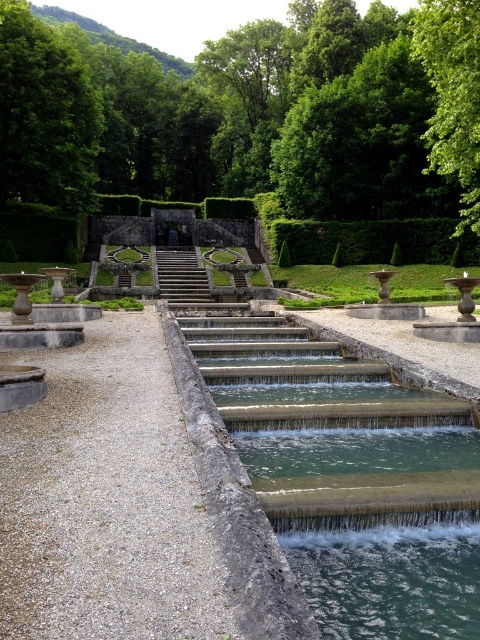
Question: Which of the following is the closest to the observer?

Choices:
 (A) green leafy tree at upper center
 (B) green leafy tree at upper right
 (C) stone steps at center
 (D) green leafy hedge at center

Answer: (B)

Question: From the image, what is the correct spatial relationship of green leafy tree at upper center in relation to green leafy hedge at center?

Choices:
 (A) right
 (B) left

Answer: (A)

Question: Considering the real-world distances, which object is closest to the clear stone water at center?

Choices:
 (A) stone steps at center
 (B) green leafy tree at upper center
 (C) green leafy hedge at center
 (D) green leafy tree at upper right

Answer: (A)

Question: Is green leafy tree at upper right smaller than stone steps at center?

Choices:
 (A) no
 (B) yes

Answer: (A)

Question: Considering the real-world distances, which object is farthest from the clear stone water at center?

Choices:
 (A) green leafy tree at upper left
 (B) green leafy hedge at center

Answer: (A)

Question: Is green leafy tree at upper left thinner than green leafy tree at upper right?

Choices:
 (A) yes
 (B) no

Answer: (A)